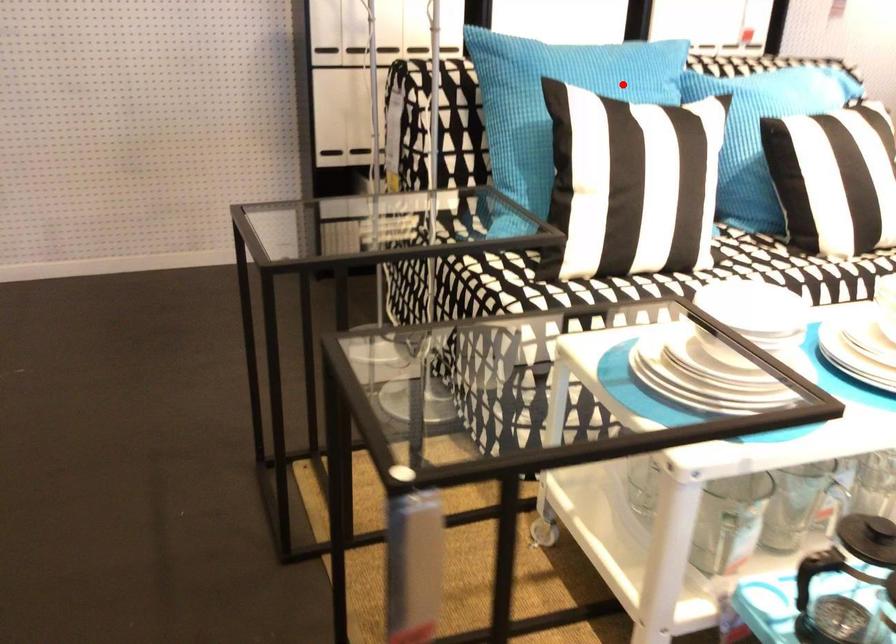
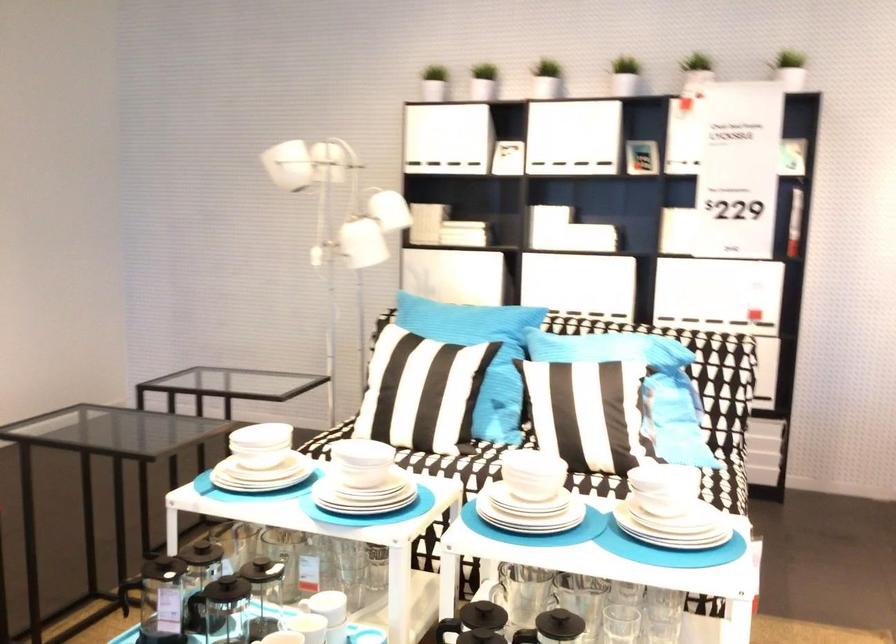
Where in the second image is the point corresponding to the highlighted location from the first image?

(467, 324)